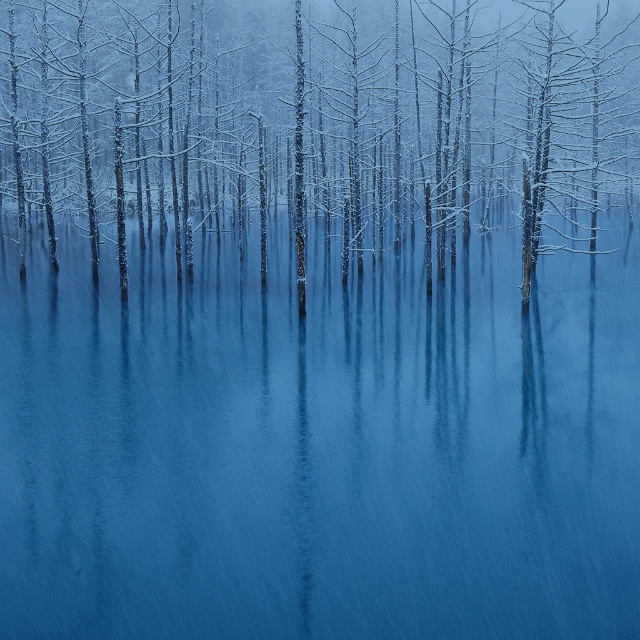
Question: Can you confirm if blue glossy water at center is bigger than snow-covered tree at center?

Choices:
 (A) yes
 (B) no

Answer: (B)

Question: Which point is closer to the camera?

Choices:
 (A) (109, 26)
 (B) (248, 566)

Answer: (B)

Question: Which of the following is the farthest from the observer?

Choices:
 (A) blue glossy water at center
 (B) snow-covered tree at center

Answer: (B)

Question: Does blue glossy water at center appear over snow-covered tree at center?

Choices:
 (A) no
 (B) yes

Answer: (A)

Question: Can you confirm if blue glossy water at center is positioned to the left of snow-covered tree at center?

Choices:
 (A) yes
 (B) no

Answer: (A)